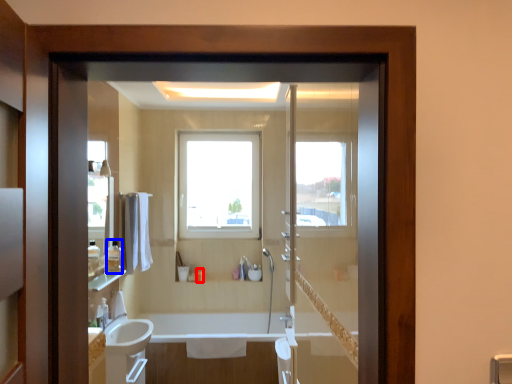
Question: Which object is closer to the camera taking this photo, toiletry (highlighted by a red box) or toiletry (highlighted by a blue box)?

Choices:
 (A) toiletry
 (B) toiletry

Answer: (B)